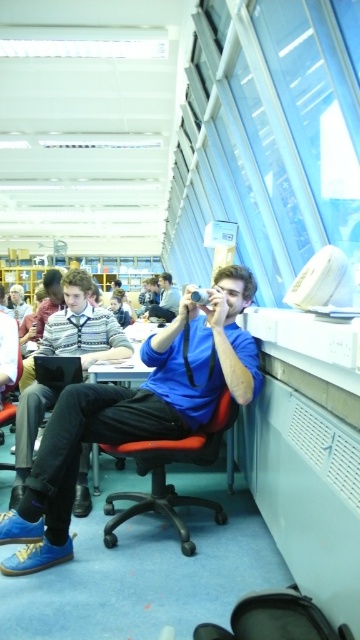
Is black plastic chair at center below matte plastic table at center?

Yes.

Does black plastic chair at center have a lesser width compared to matte plastic table at center?

No, black plastic chair at center is not thinner than matte plastic table at center.

Which is behind, point (118, 456) or point (118, 372)?

Point (118, 372)

This screenshot has height=640, width=360. In order to click on black plastic chair at center in this screenshot , I will do `click(164, 472)`.

Does black plastic chair at center have a greater height compared to matte blue shirt at center?

No, black plastic chair at center is not taller than matte blue shirt at center.

Which of these two, black plastic chair at center or matte blue shirt at center, stands shorter?

With less height is black plastic chair at center.

Describe the element at coordinates (164, 472) in the screenshot. I see `black plastic chair at center` at that location.

This screenshot has height=640, width=360. In order to click on black plastic chair at center in this screenshot , I will do `click(164, 472)`.

Is point (77, 410) positioned in front of point (42, 349)?

Yes.

From the picture: Who is more distant from viewer, (78, 397) or (19, 468)?

The point (19, 468) is more distant.

The height and width of the screenshot is (640, 360). Identify the location of blue suede shoes at lower left. (136, 412).